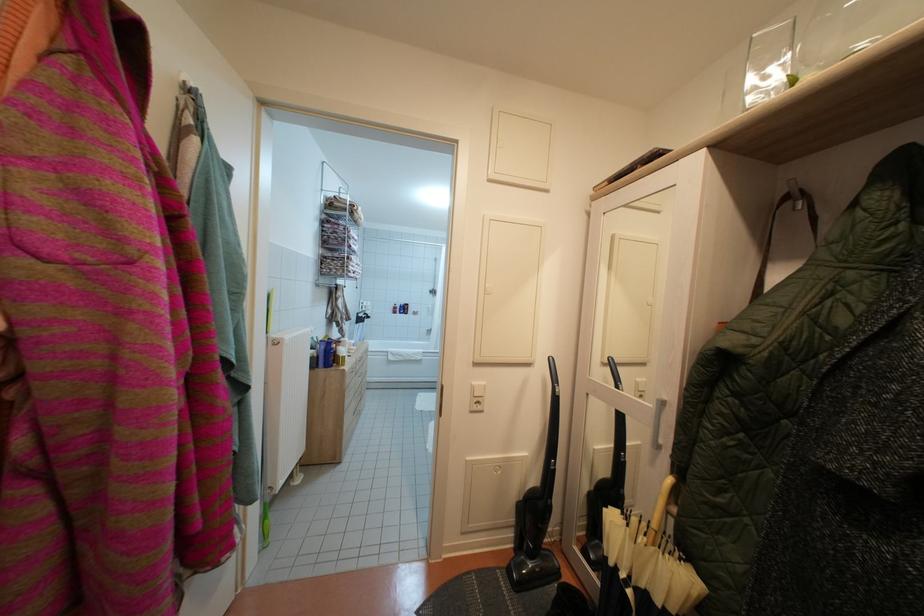
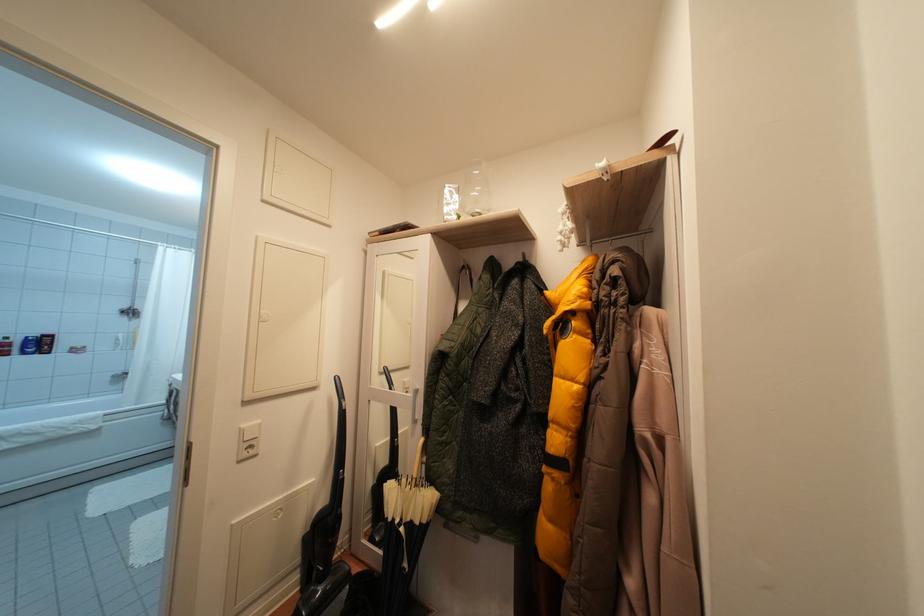
Question: The camera is either moving clockwise (left) or counter-clockwise (right) around the object. The first image is from the beginning of the video and the second image is from the end. Is the camera moving left or right when shooting the video?

Choices:
 (A) Left
 (B) Right

Answer: (A)